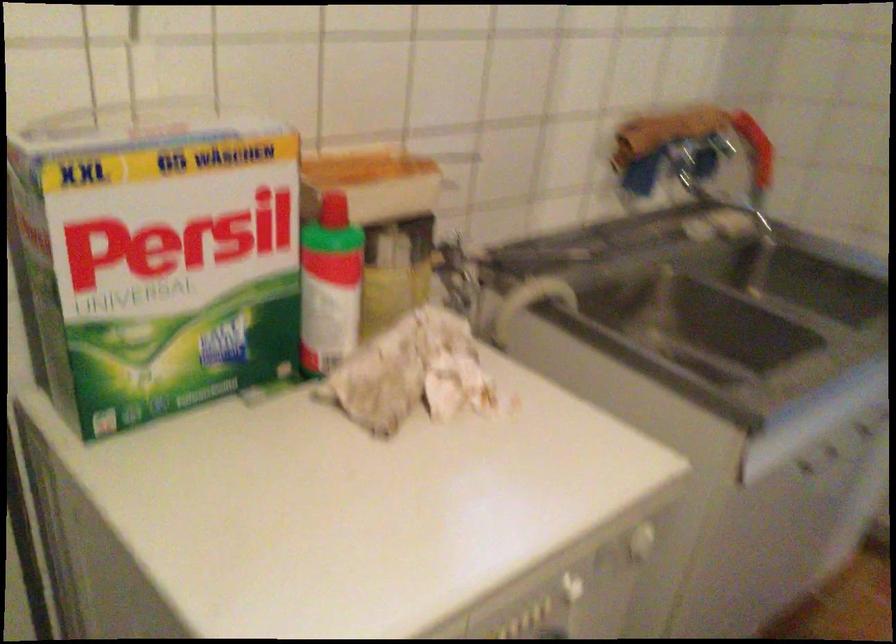
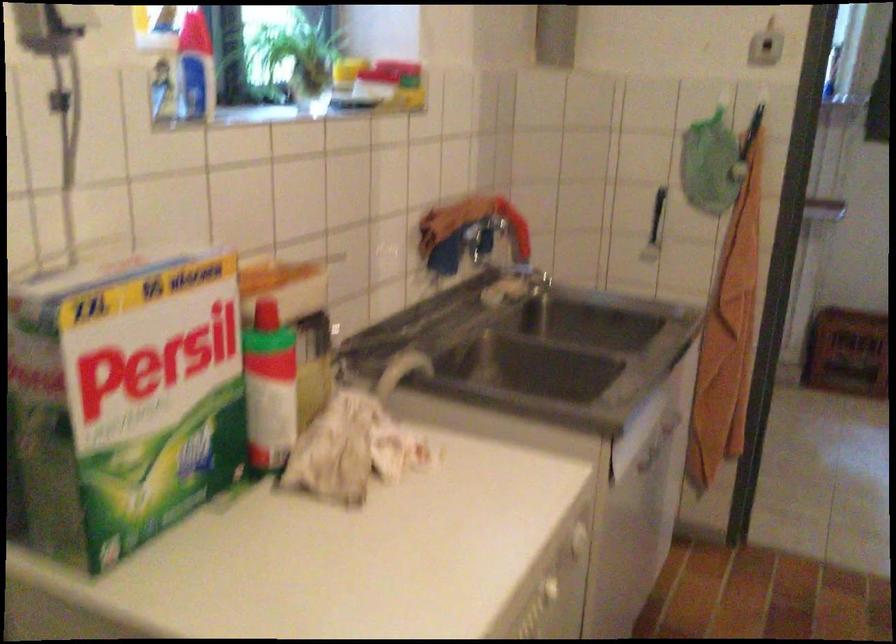
Question: The camera is either moving clockwise (left) or counter-clockwise (right) around the object. The first image is from the beginning of the video and the second image is from the end. Is the camera moving left or right when shooting the video?

Choices:
 (A) Left
 (B) Right

Answer: (A)